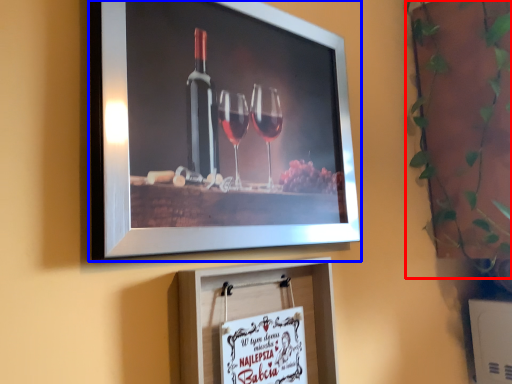
Question: Which of the following is the closest to the observer, plant (highlighted by a red box) or picture frame (highlighted by a blue box)?

Choices:
 (A) plant
 (B) picture frame

Answer: (B)